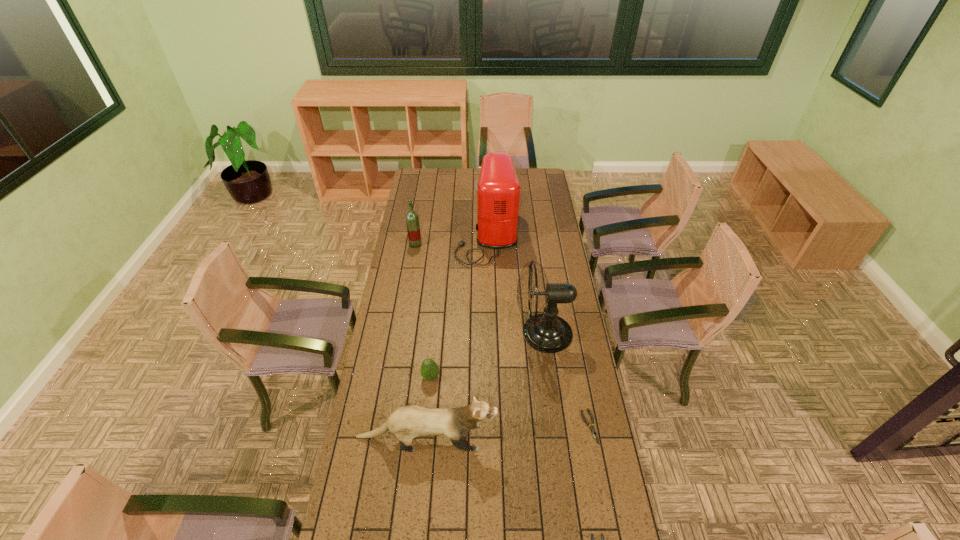
Locate an element on the screen. kitchen mixer is located at coordinates (498, 188).

Where is `the third farthest object`? Image resolution: width=960 pixels, height=540 pixels. the third farthest object is located at coordinates (547, 332).

At what (x,y) coordinates should I click in order to perform the action: click on the fifth shortest object. Please return your answer as a coordinate pair (x, y). This screenshot has width=960, height=540. Looking at the image, I should click on (412, 220).

Image resolution: width=960 pixels, height=540 pixels. Find the location of `ferret`. ferret is located at coordinates (407, 422).

This screenshot has width=960, height=540. Find the location of `avocado`. avocado is located at coordinates (429, 369).

What are the coordinates of `the third shortest object` in the screenshot? It's located at (429, 369).

Identify the location of the farther pliers. This screenshot has height=540, width=960. (592, 428).

This screenshot has width=960, height=540. I want to click on the shortest object, so click(x=592, y=428).

Find the location of a particular element. This screenshot has width=960, height=540. vacant area situated on the front-facing side of the kitchen mixer is located at coordinates (443, 235).

Identify the location of vacant space situated on the front-facing side of the kitchen mixer. This screenshot has width=960, height=540. (421, 235).